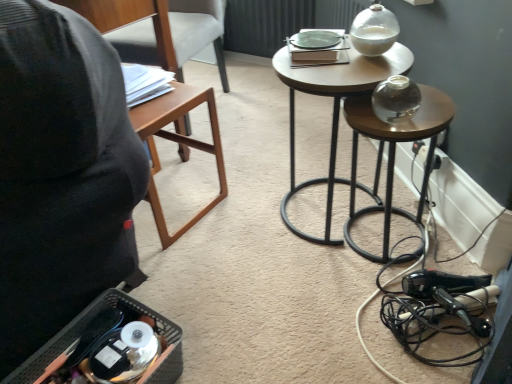
Question: Is wooden chair at left far away from white plastic electric outlet at lower right?

Choices:
 (A) no
 (B) yes

Answer: (B)

Question: Is wooden chair at left wider than white plastic electric outlet at lower right?

Choices:
 (A) no
 (B) yes

Answer: (B)

Question: Does wooden chair at left have a larger size compared to white plastic electric outlet at lower right?

Choices:
 (A) no
 (B) yes

Answer: (B)

Question: Does wooden chair at left appear on the left side of white plastic electric outlet at lower right?

Choices:
 (A) no
 (B) yes

Answer: (B)

Question: Is wooden chair at left located outside white plastic electric outlet at lower right?

Choices:
 (A) no
 (B) yes

Answer: (B)

Question: Is wooden chair at left taller or shorter than transparent glass vase at center right, positioned as the second stool in left-to-right order?

Choices:
 (A) short
 (B) tall

Answer: (B)

Question: From a real-world perspective, is wooden chair at left positioned above or below transparent glass vase at center right, the first stool in the right-to-left sequence?

Choices:
 (A) above
 (B) below

Answer: (A)

Question: In terms of width, does wooden chair at left look wider or thinner when compared to transparent glass vase at center right, positioned as the second stool in left-to-right order?

Choices:
 (A) wide
 (B) thin

Answer: (A)

Question: Based on their sizes in the image, would you say wooden chair at left is bigger or smaller than transparent glass vase at center right, positioned as the second stool in left-to-right order?

Choices:
 (A) small
 (B) big

Answer: (B)

Question: From the image's perspective, is wooden glossy stool at upper center, positioned as the 2th stool in right-to-left order, positioned above or below transparent glass vase at center right, the first stool in the right-to-left sequence?

Choices:
 (A) above
 (B) below

Answer: (A)

Question: In terms of size, does wooden glossy stool at upper center, which ranks as the first stool in left-to-right order, appear bigger or smaller than transparent glass vase at center right, the first stool in the right-to-left sequence?

Choices:
 (A) big
 (B) small

Answer: (A)

Question: From a real-world perspective, is wooden glossy stool at upper center, positioned as the 2th stool in right-to-left order, physically located above or below transparent glass vase at center right, the first stool in the right-to-left sequence?

Choices:
 (A) below
 (B) above

Answer: (B)

Question: Considering the positions of point (362, 81) and point (424, 97), is point (362, 81) closer or farther from the camera than point (424, 97)?

Choices:
 (A) farther
 (B) closer

Answer: (B)

Question: From a real-world perspective, relative to transparent glass vase at center right, the first stool in the right-to-left sequence, is brown wood table at left vertically above or below?

Choices:
 (A) above
 (B) below

Answer: (B)

Question: In terms of width, does brown wood table at left look wider or thinner when compared to transparent glass vase at center right, the first stool in the right-to-left sequence?

Choices:
 (A) thin
 (B) wide

Answer: (A)